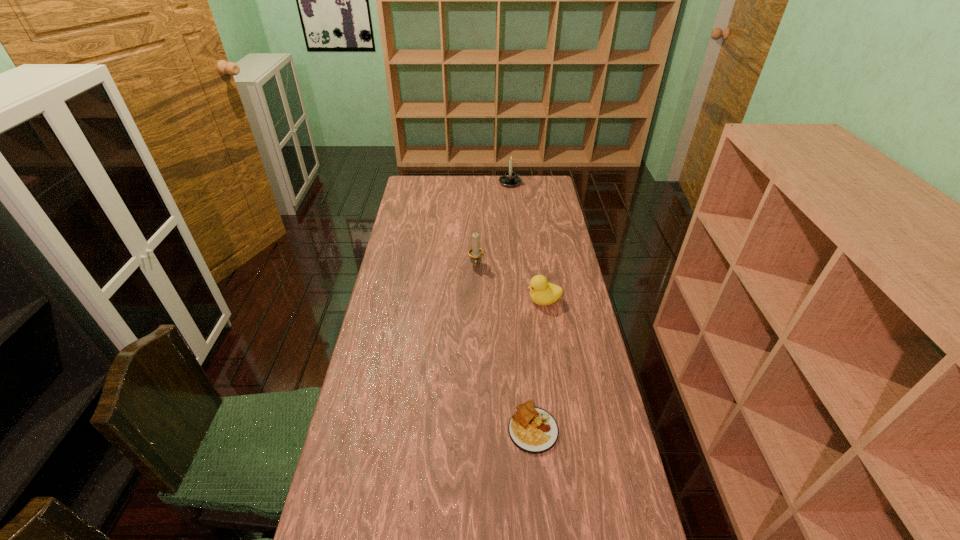
Where is `vacant region located 0.240m on the front-facing side of the second nearest object`? The height and width of the screenshot is (540, 960). vacant region located 0.240m on the front-facing side of the second nearest object is located at coordinates (462, 301).

At what (x,y) coordinates should I click in order to perform the action: click on free space located on the front-facing side of the second nearest object. Please return your answer as a coordinate pair (x, y). Image resolution: width=960 pixels, height=540 pixels. Looking at the image, I should click on (505, 301).

At what (x,y) coordinates should I click in order to perform the action: click on vacant area situated 0.110m on the front-facing side of the second nearest object. Please return your answer as a coordinate pair (x, y). Image resolution: width=960 pixels, height=540 pixels. Looking at the image, I should click on (497, 301).

You are a GUI agent. You are given a task and a screenshot of the screen. Output one action in this format:
    pyautogui.click(x=<x>, y=<y>)
    Task: Click on the free space located on the right of the shortest object
    The image size is (960, 540).
    Given the screenshot: What is the action you would take?
    pyautogui.click(x=590, y=428)

Image resolution: width=960 pixels, height=540 pixels. Identify the location of object present at the far edge. (510, 179).

Identify the location of duck located in the right edge section of the desktop. The height and width of the screenshot is (540, 960). (542, 293).

Locate an element on the screen. omelet that is positioned at the right edge is located at coordinates (533, 430).

Find the location of a particular element. vacant space at the left edge is located at coordinates (421, 250).

Image resolution: width=960 pixels, height=540 pixels. Identify the location of vacant space at the right edge. (564, 430).

The width and height of the screenshot is (960, 540). I want to click on free region at the far right corner of the desktop, so click(524, 190).